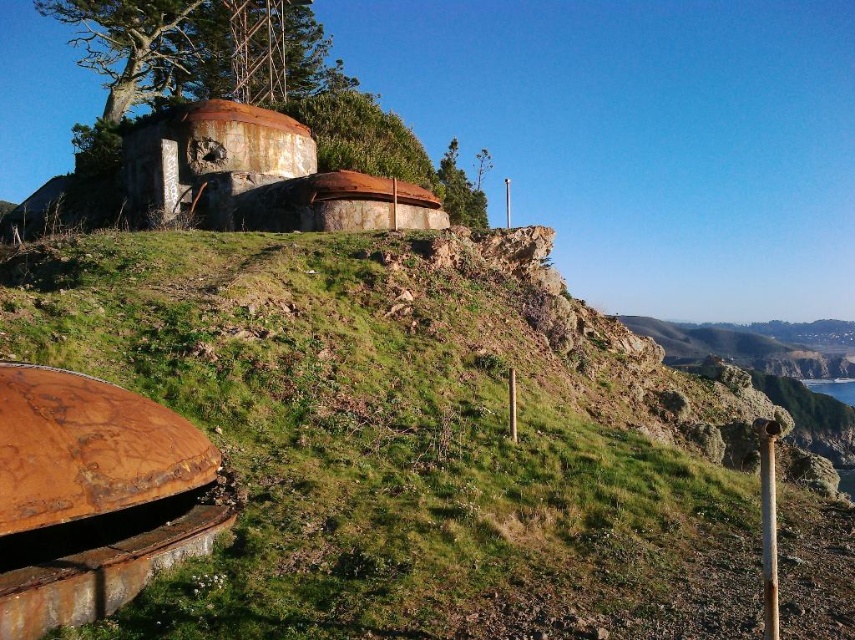
Question: From the image, what is the correct spatial relationship of green grassy at center in relation to green leafy tree at upper center?

Choices:
 (A) below
 (B) above

Answer: (A)

Question: Can you confirm if green grassy at center is positioned above green leafy tree at upper left?

Choices:
 (A) yes
 (B) no

Answer: (B)

Question: Which of these objects is positioned farthest from the green grassy at center?

Choices:
 (A) green leafy tree at upper center
 (B) green leafy tree at upper left

Answer: (B)

Question: Is green grassy at center wider than green leafy tree at upper center?

Choices:
 (A) no
 (B) yes

Answer: (B)

Question: Estimate the real-world distances between objects in this image. Which object is closer to the green leafy tree at upper center?

Choices:
 (A) green leafy tree at upper left
 (B) green grassy at center

Answer: (B)

Question: Which object is positioned closest to the green leafy tree at upper left?

Choices:
 (A) green leafy tree at upper center
 (B) green grassy at center

Answer: (B)